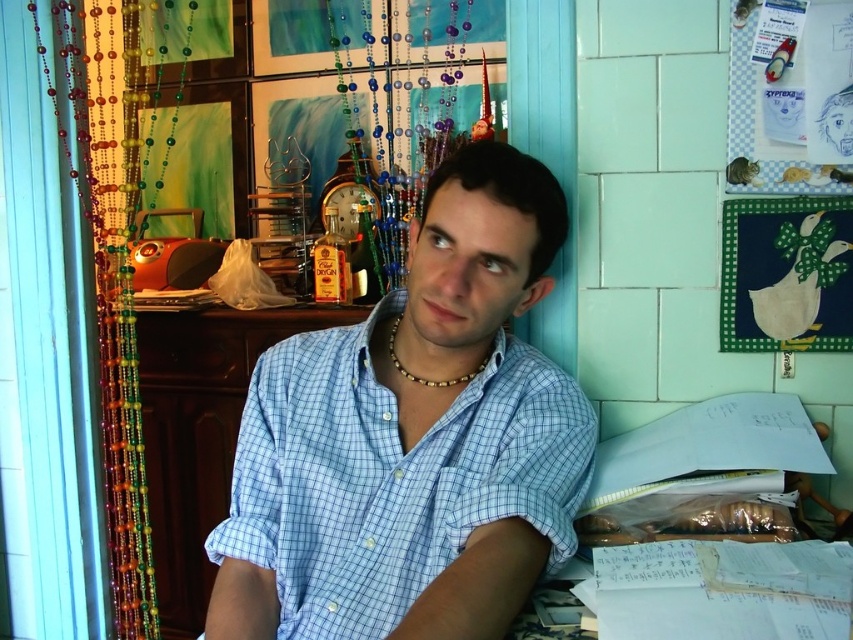
You are taking a photo of the scene and want to focus on both the point at (462, 157) and the point at (59, 234). Which point should you adjust your focus to first to ensure both are in clear view?

You should focus on point (59, 234) first because it is farther from the camera, so adjusting focus starting from there will help ensure both points are in clear view.

You are standing in the room and want to place a small plant on the green fabric quilt at upper right. The coordinates given are for the center of the quilt. If you walk to the point at coordinates point (786, 275), will you be placing the plant in the center of the green fabric quilt at upper right?

Yes, the point (786, 275) is on the green fabric quilt at upper right, so placing the plant there would be at the center of the quilt.

You are a delivery person who needs to place a package between the beaded curtain at left and the green fabric quilt at upper right. The package is 1.5 meters long. Can you fit it between them?

The beaded curtain at left and green fabric quilt at upper right are 1.47 meters apart, so the 1.5 meter package cannot fit between them as it is slightly longer than the available space.